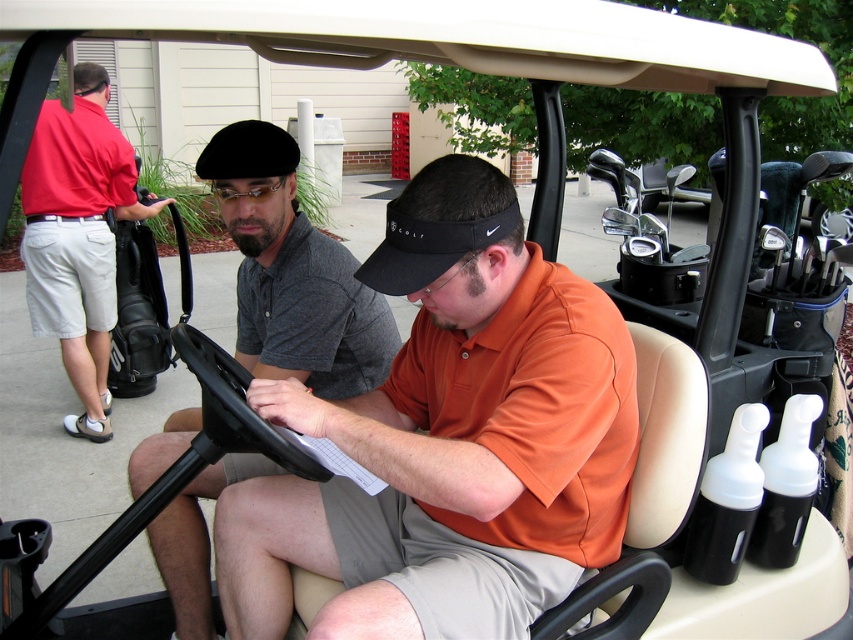
Measure the distance between point [392,253] and camera.

Point [392,253] is 1.47 meters from camera.

Where is `orange cotton shirt at center`? This screenshot has height=640, width=853. orange cotton shirt at center is located at coordinates (451, 464).

Which is in front, point (461, 611) or point (93, 352)?

Positioned in front is point (461, 611).

I want to click on orange cotton shirt at center, so click(451, 464).

Does orange cotton shirt at center have a lesser width compared to dark gray polo shirt at center?

No, orange cotton shirt at center is not thinner than dark gray polo shirt at center.

Does orange cotton shirt at center appear on the left side of dark gray polo shirt at center?

No, orange cotton shirt at center is not to the left of dark gray polo shirt at center.

The width and height of the screenshot is (853, 640). Find the location of `orange cotton shirt at center`. orange cotton shirt at center is located at coordinates (451, 464).

In the scene shown: Can you confirm if dark gray polo shirt at center is thinner than red cotton polo shirt at left?

In fact, dark gray polo shirt at center might be wider than red cotton polo shirt at left.

Is the position of dark gray polo shirt at center more distant than that of red cotton polo shirt at left?

No, dark gray polo shirt at center is closer to the viewer.

The height and width of the screenshot is (640, 853). What do you see at coordinates (292, 273) in the screenshot?
I see `dark gray polo shirt at center` at bounding box center [292, 273].

In order to click on dark gray polo shirt at center in this screenshot , I will do `click(292, 273)`.